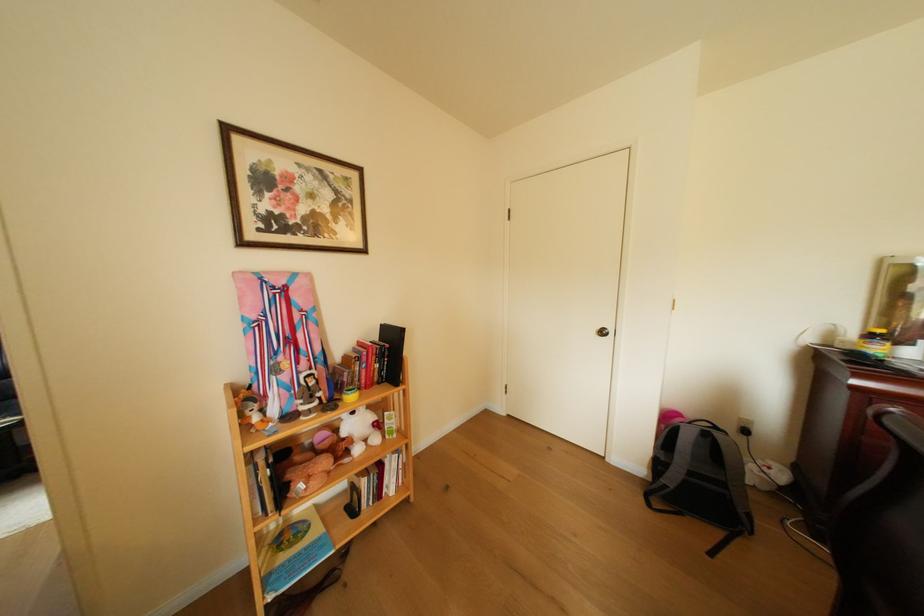
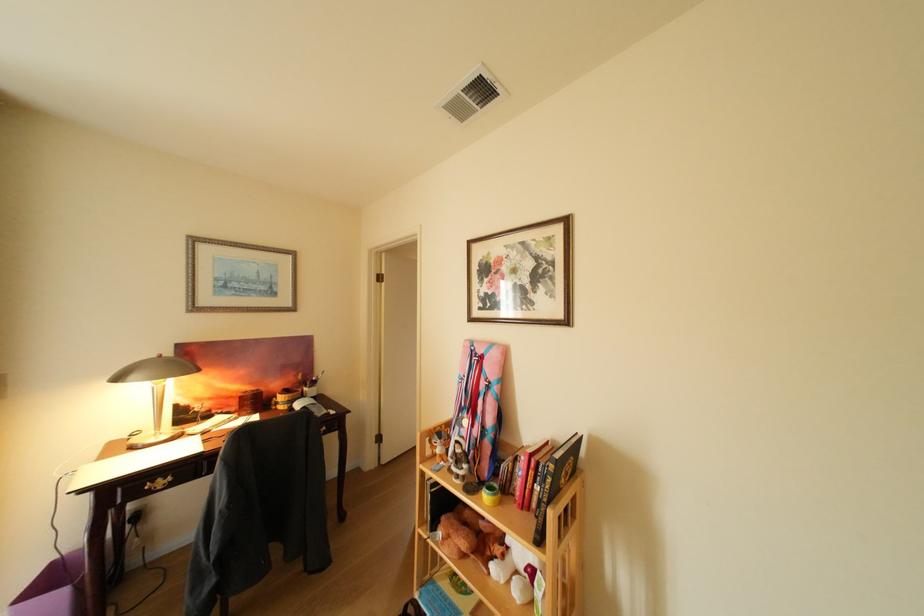
The point at (388, 365) is marked in the first image. Where is the corresponding point in the second image?

(548, 484)